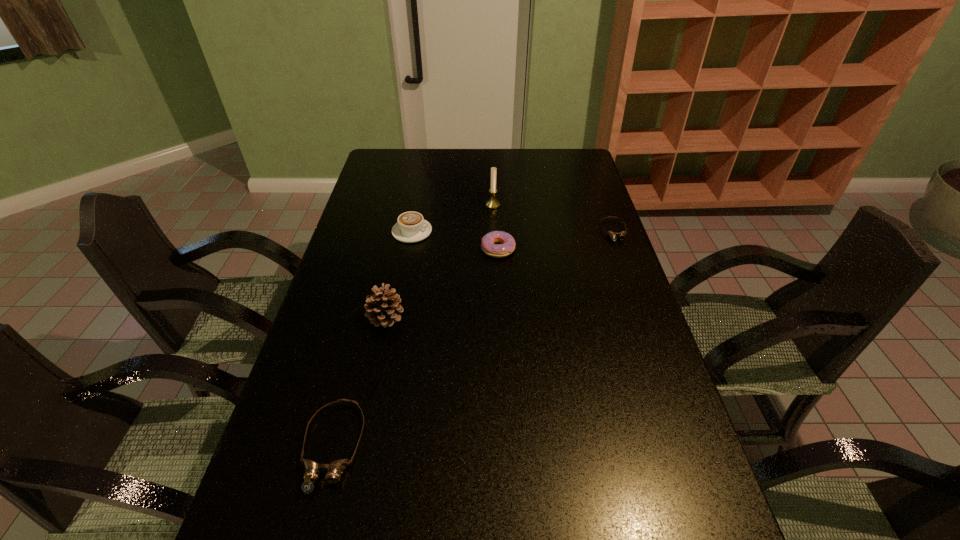
Locate an element on the screen. The height and width of the screenshot is (540, 960). vacant space that's between the second nearest object and the cappuccino is located at coordinates (399, 274).

Find the location of a particular element. Image resolution: width=960 pixels, height=540 pixels. empty location between the farthest object and the fifth farthest object is located at coordinates (440, 261).

Where is `blank region between the fourth tallest object and the fourth shortest object`? blank region between the fourth tallest object and the fourth shortest object is located at coordinates (455, 240).

You are a GUI agent. You are given a task and a screenshot of the screen. Output one action in this format:
    pyautogui.click(x=<x>, y=<y>)
    Task: Click on the empty location between the farthest object and the shorter goggles
    This screenshot has width=960, height=540.
    Given the screenshot: What is the action you would take?
    pyautogui.click(x=553, y=218)

Image resolution: width=960 pixels, height=540 pixels. Identify the location of free point between the fourth tallest object and the tallest object. (495, 227).

Locate an element on the screen. This screenshot has width=960, height=540. the closest object relative to the pinecone is located at coordinates (312, 470).

Identify the location of the fourth closest object to the tallest object. Image resolution: width=960 pixels, height=540 pixels. (382, 309).

The height and width of the screenshot is (540, 960). Identify the location of free space that satisfies the following two spatial constraints: 1. with the handle on the right side of the third tallest object; 2. on the left side of the doughnut. (409, 249).

Where is `free space that satisfies the following two spatial constraints: 1. on the front lenses and sides of the shortest object; 2. with the handle on the right side of the cappuccino`? The image size is (960, 540). free space that satisfies the following two spatial constraints: 1. on the front lenses and sides of the shortest object; 2. with the handle on the right side of the cappuccino is located at coordinates click(613, 232).

Locate an element on the screen. vacant point that satisfies the following two spatial constraints: 1. with the handle on the right side of the cappuccino; 2. on the left side of the doughnut is located at coordinates (409, 249).